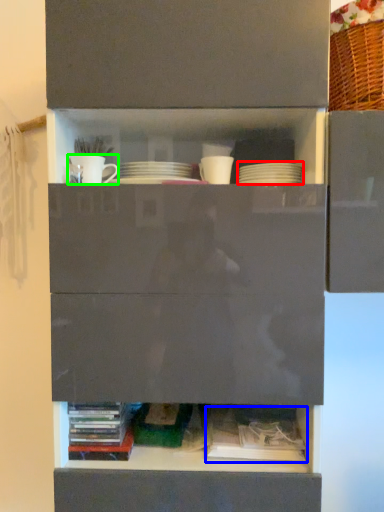
Question: Which object is positioned closest to tableware (highlighted by a red box)? Select from book (highlighted by a blue box) and tableware (highlighted by a green box).

Choices:
 (A) book
 (B) tableware

Answer: (B)